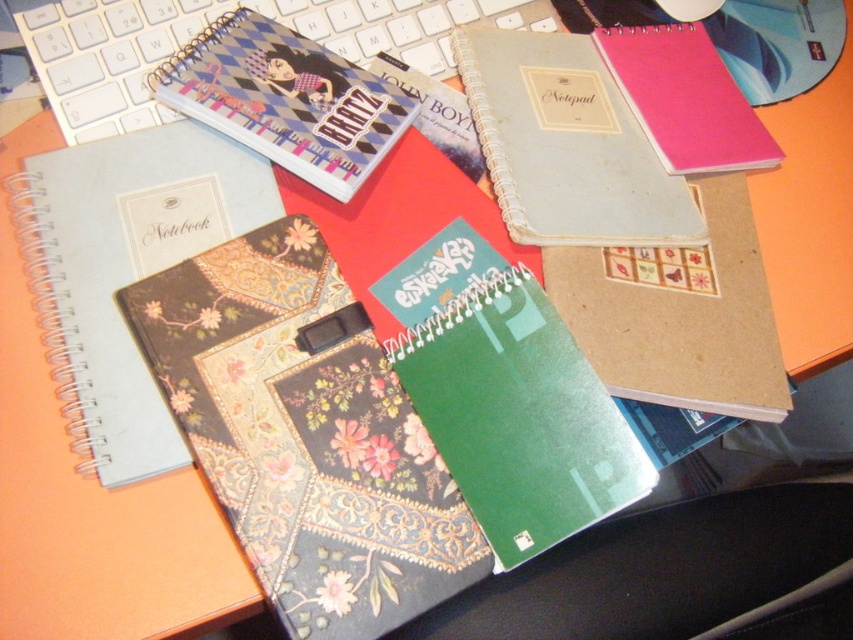
You are organizing a desk and need to place the light blue paper notepad at center and the white plastic keyboard at upper left into a drawer. The drawer has a height limit of 10 cm. Which item might not fit if the keyboard is 8 cm tall?

The light blue paper notepad at center is taller than the white plastic keyboard at upper left, which is 8 cm tall. Therefore, the light blue paper notepad at center might exceed the 10 cm height limit and not fit in the drawer.

You are a delivery robot that needs to place a package on the desk. The package requires a flat surface at least 28 inches away from the camera to avoid tipping over. Is the point at coordinates point (343, 145) suitable for placing the package?

The distance of point (343, 145) from camera is 27.49 inches, which is less than the required 28 inches. Therefore, placing the package there may cause it to tip over, so it is not suitable.